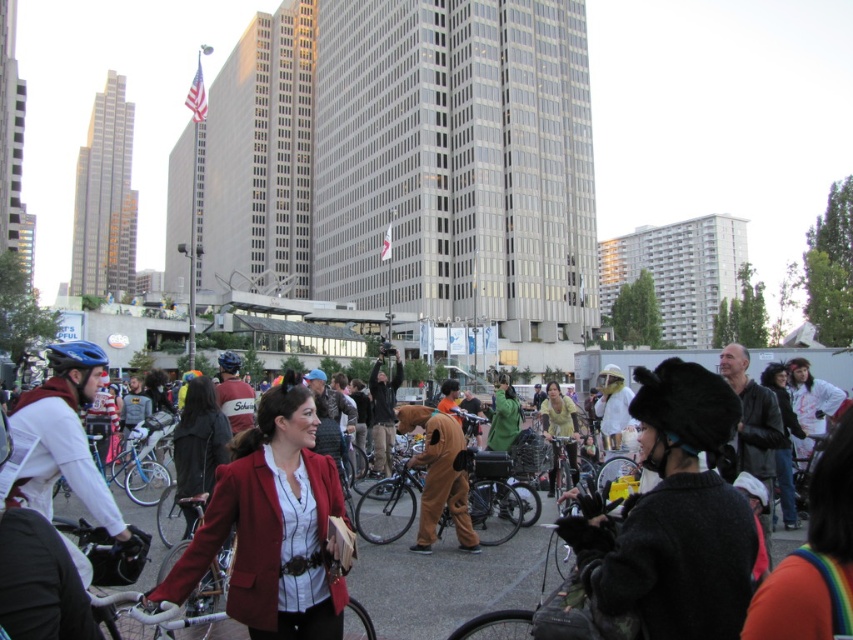
Which of these two, silver metallic bicycle at center or matte black helmet at center, stands taller?

With more height is silver metallic bicycle at center.

Does silver metallic bicycle at center have a lesser width compared to matte black helmet at center?

No, silver metallic bicycle at center is not thinner than matte black helmet at center.

In order to click on silver metallic bicycle at center in this screenshot , I will do `click(199, 600)`.

At what (x,y) coordinates should I click in order to perform the action: click on silver metallic bicycle at center. Please return your answer as a coordinate pair (x, y). This screenshot has height=640, width=853. Looking at the image, I should click on (199, 600).

Who is positioned more to the left, silver metallic bicycle at center or blue matte bicycle helmet at center?

blue matte bicycle helmet at center is more to the left.

Which of these two, silver metallic bicycle at center or blue matte bicycle helmet at center, stands taller?

Standing taller between the two is silver metallic bicycle at center.

What do you see at coordinates (199, 600) in the screenshot? This screenshot has width=853, height=640. I see `silver metallic bicycle at center` at bounding box center [199, 600].

Image resolution: width=853 pixels, height=640 pixels. I want to click on silver metallic bicycle at center, so click(199, 600).

Does brown fabric bicycle at center have a greater height compared to blue matte bicycle helmet at center?

Yes.

Locate an element on the screen. brown fabric bicycle at center is located at coordinates (389, 506).